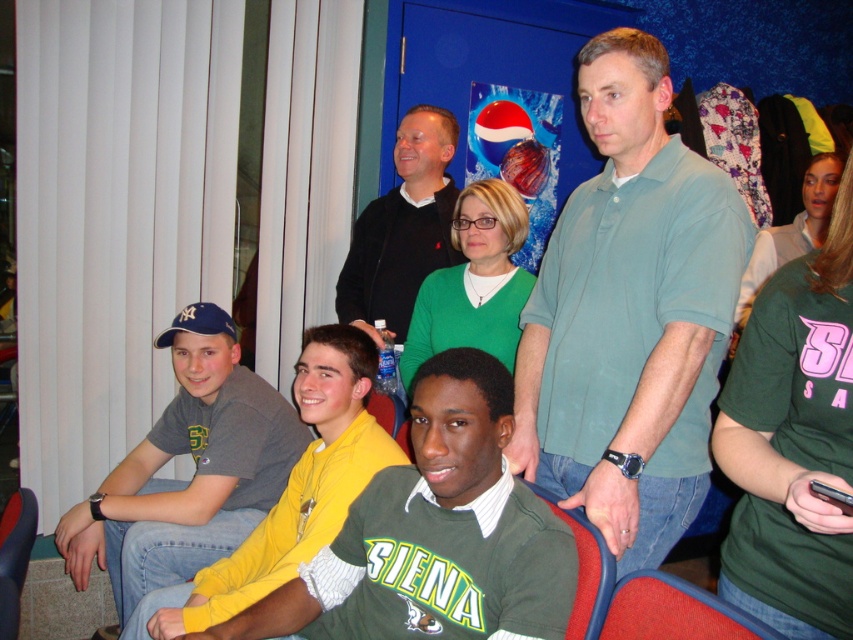
Which is more to the right, green cotton polo shirt at center or gray cotton t-shirt at left?

green cotton polo shirt at center

Does green cotton polo shirt at center have a lesser width compared to gray cotton t-shirt at left?

Correct, green cotton polo shirt at center's width is less than gray cotton t-shirt at left's.

Does point (631, 388) come closer to viewer compared to point (372, 442)?

Yes, it is.

Where is `green cotton polo shirt at center`? Image resolution: width=853 pixels, height=640 pixels. green cotton polo shirt at center is located at coordinates (630, 314).

Based on the photo, is the position of green jersey at center less distant than that of red fabric chair at lower center?

Yes, it is.

Is point (502, 566) closer to viewer compared to point (611, 563)?

Yes, point (502, 566) is closer to viewer.

Between point (509, 515) and point (531, 488), which one is positioned behind?

The point (531, 488) is more distant.

Where is `green jersey at center`? green jersey at center is located at coordinates (434, 532).

Between gray cotton t-shirt at left and red fabric chair at lower right, which one is positioned higher?

gray cotton t-shirt at left

Is gray cotton t-shirt at left wider than red fabric chair at lower right?

Yes, gray cotton t-shirt at left is wider than red fabric chair at lower right.

Find the location of a particular element. The image size is (853, 640). gray cotton t-shirt at left is located at coordinates [x=292, y=490].